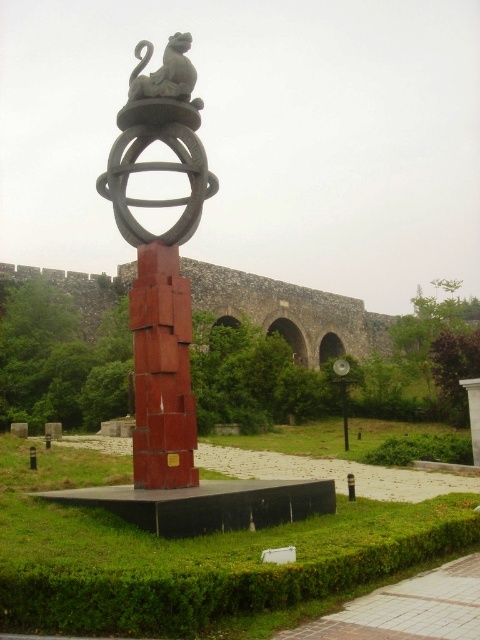
Looking at the park scene, there is a red painted metal sculpture at center and a matte gray stone statue at upper center. Which one is positioned to the left?

The red painted metal sculpture at center is positioned to the left of the matte gray stone statue at upper center.